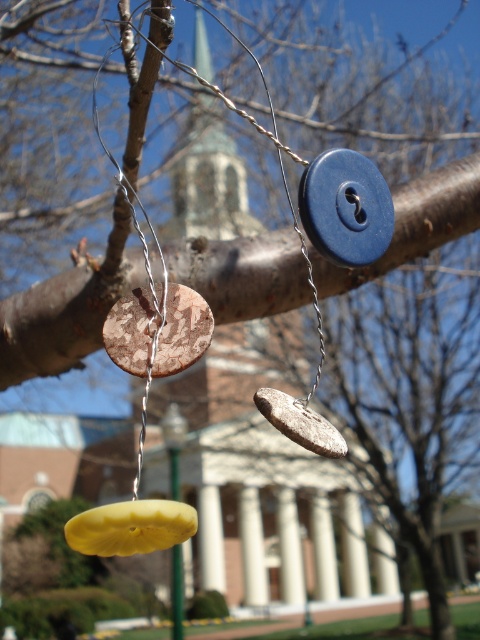
You are an architect designing a model of this scene. You need to place a small flag exactly at the position of the blue matte button at center. What coordinates should you use for the flag?

The coordinates for the blue matte button at center are 0.325 in the x direction and 0.721 in the y direction, so you should place the flag at point (346,208).

You are an artist setting up a still life. You have two objects hanging from a branch in front of you. The blue matte button at center and the rustic wood coin at center. Which object is positioned higher on the branch?

The blue matte button at center is positioned higher on the branch than the rustic wood coin at center.